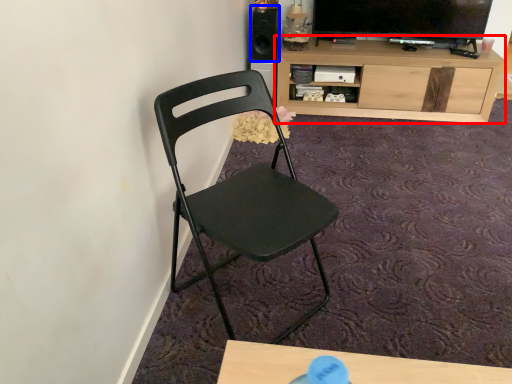
Question: Which of the following is the closest to the observer, cabinetry (highlighted by a red box) or speaker (highlighted by a blue box)?

Choices:
 (A) cabinetry
 (B) speaker

Answer: (A)